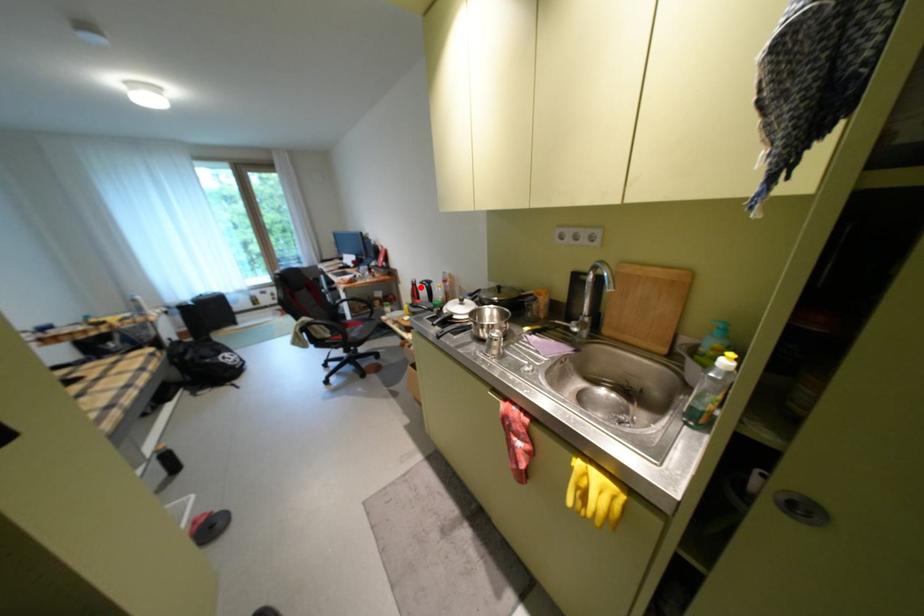
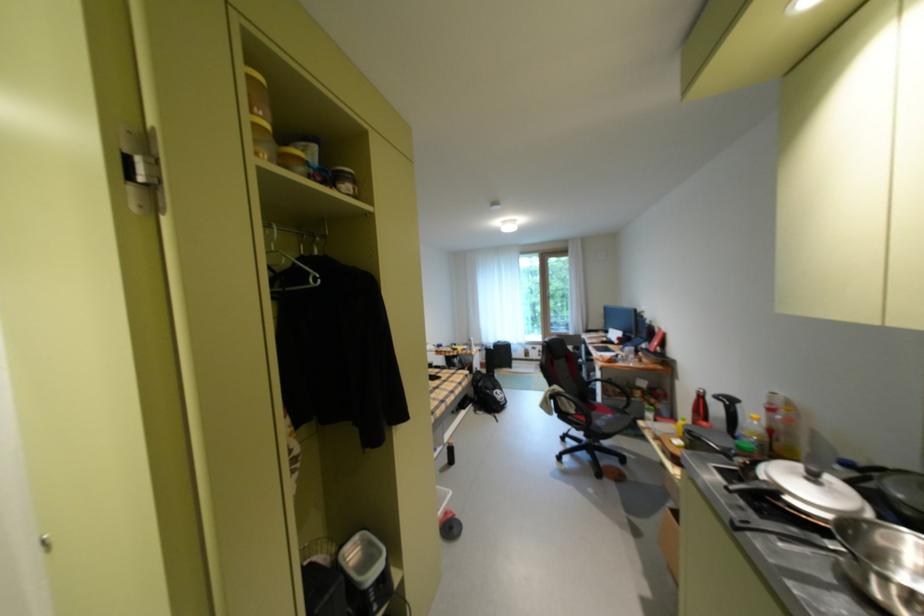
Find the pixel in the second image that matches the highlighted location in the first image.

(704, 398)